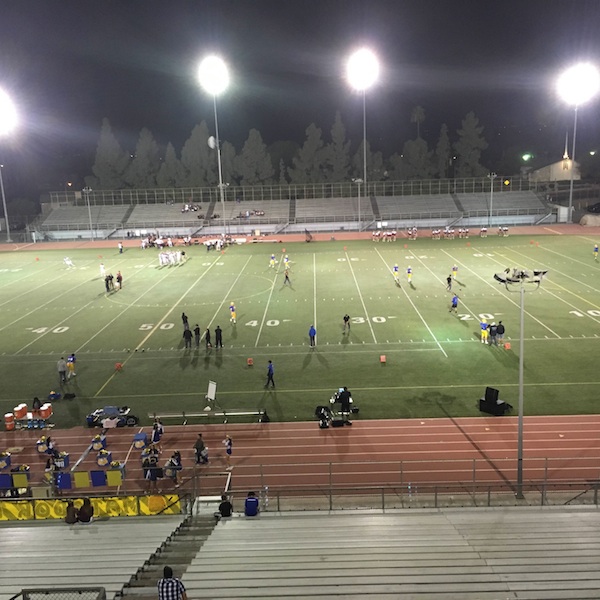
Image resolution: width=600 pixels, height=600 pixels. Identify the location of light. (x=576, y=74).